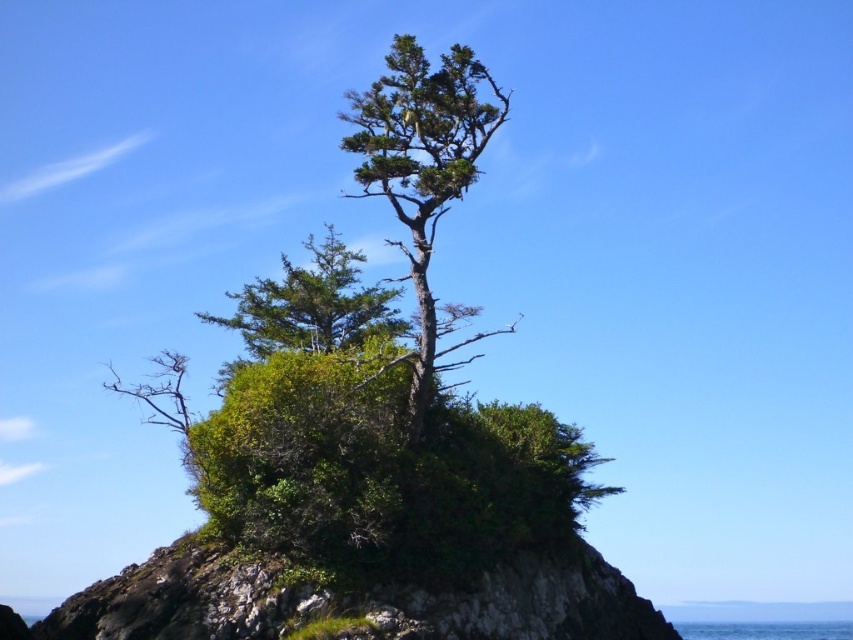
You are a hiker who wants to take a photo of the green textured tree at center and the blue liquid water at lower center. Which object will appear smaller in the photo?

The green textured tree at center will appear smaller in the photo because it has a lesser width compared to the blue liquid water at lower center.

You are a hiker who wants to take a photo of the green textured tree at center. However, you notice the blue liquid water at lower center might block the view. Based on their sizes, which object would you need to move closer to or farther from to ensure the tree is fully visible in the photo?

The green textured tree at center is larger in size than the blue liquid water at lower center. To ensure the tree is fully visible, you should move closer to the tree or farther from the blue liquid water at lower center so that the smaller water area doesn

You are standing on the rocky outcrop and want to look at both the green textured tree at center and the blue liquid water at lower center. Which object will appear larger to you?

The green textured tree at center will appear larger because it is closer to you than the blue liquid water at lower center.